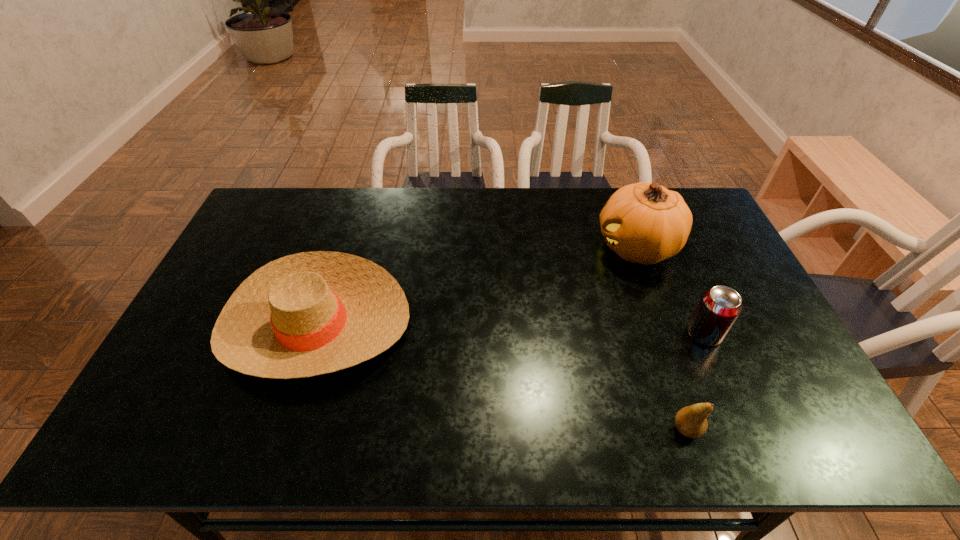
Locate an element on the screen. Image resolution: width=960 pixels, height=540 pixels. free location at the near left corner of the desktop is located at coordinates (156, 429).

In order to click on free location at the far right corner of the desktop in this screenshot , I will do [x=706, y=216].

Image resolution: width=960 pixels, height=540 pixels. In the image, there is a desktop. In order to click on vacant space at the near right corner in this screenshot , I will do `click(796, 437)`.

This screenshot has height=540, width=960. What are the coordinates of `vacant point located between the soda can and the tallest object` in the screenshot? It's located at (670, 291).

The image size is (960, 540). I want to click on vacant point located between the sunhat and the tallest object, so click(476, 286).

Where is `free point between the tallest object and the soda can`? The width and height of the screenshot is (960, 540). free point between the tallest object and the soda can is located at coordinates (670, 291).

You are a GUI agent. You are given a task and a screenshot of the screen. Output one action in this format:
    pyautogui.click(x=<x>, y=<y>)
    Task: Click on the vacant region between the sunhat and the pumpkin
    This screenshot has height=540, width=960.
    Given the screenshot: What is the action you would take?
    pyautogui.click(x=476, y=286)

At what (x,y) coordinates should I click in order to perform the action: click on free space between the soda can and the tallest object. Please return your answer as a coordinate pair (x, y). The image size is (960, 540). Looking at the image, I should click on (670, 291).

What are the coordinates of `vacant region between the pear and the leftmost object` in the screenshot? It's located at (501, 376).

Locate an element on the screen. The height and width of the screenshot is (540, 960). empty location between the sunhat and the soda can is located at coordinates (510, 329).